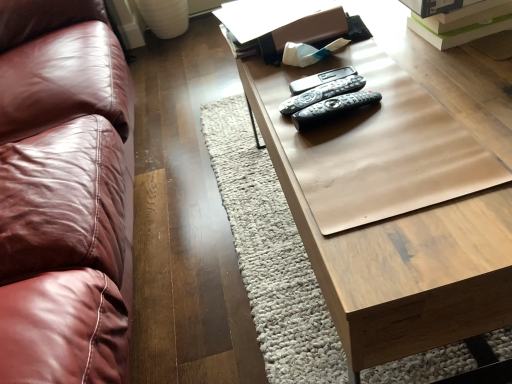
Find the location of a particular element. Image resolution: width=512 pixels, height=384 pixels. vacant space to the right of black plastic remote at center, the third remote from the front is located at coordinates (407, 71).